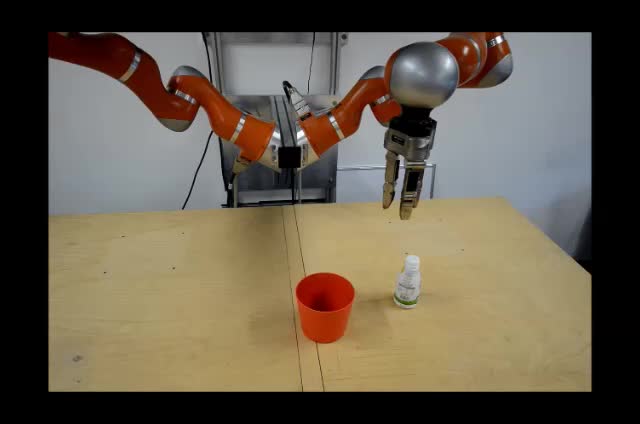
At what (x,y) coordinates should I click in order to perform the action: click on table. Please return your answer as a coordinate pair (x, y). Looking at the image, I should click on (212, 316).